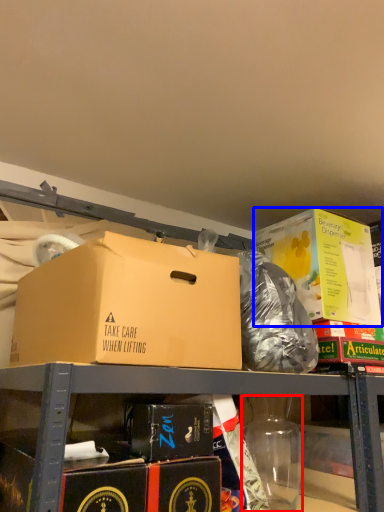
Question: Which object appears farthest to the camera in this image, bottle (highlighted by a red box) or box (highlighted by a blue box)?

Choices:
 (A) bottle
 (B) box

Answer: (B)